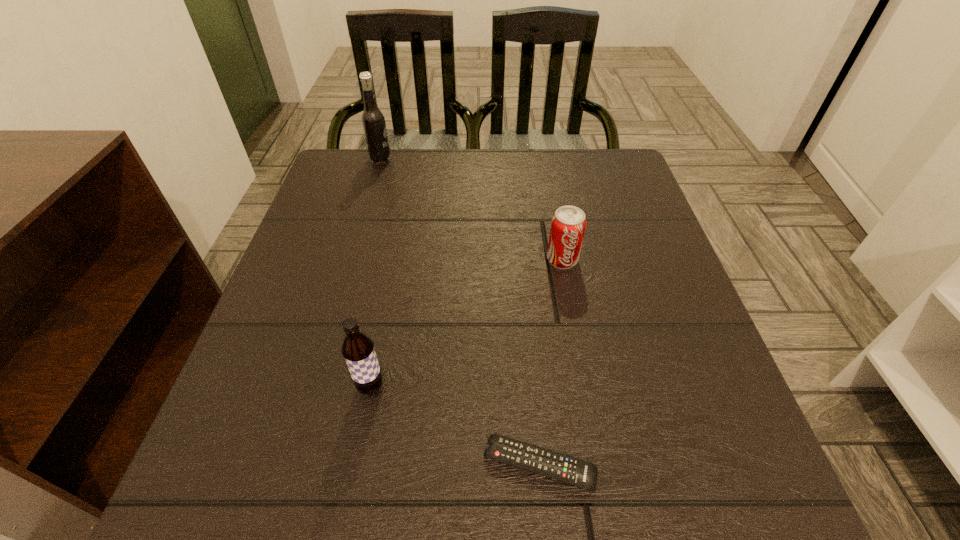
I want to click on free space in the image that satisfies the following two spatial constraints: 1. on the label of the farther root beer; 2. on the left side of the second farthest object, so click(x=351, y=260).